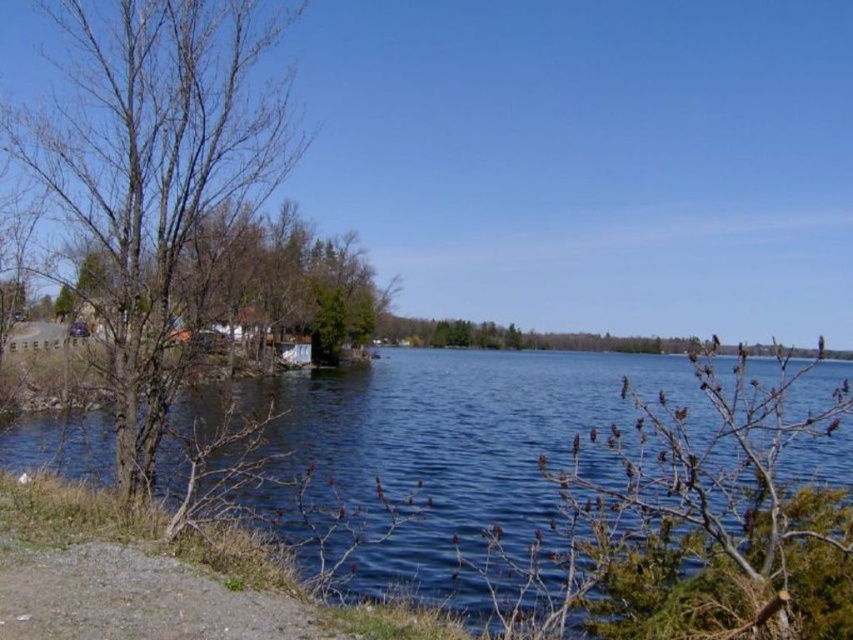
You are standing at the lakeside and want to reach a specific point marked as point (532, 504). If your walking speed is 1.2 meters per second, how long will it take you to reach that point?

The point (532, 504) is 11.32 meters away from the viewer. At a walking speed of 1.2 meters per second, it would take approximately 9.43 seconds to reach the point.

You are standing on the lakeside path and want to cross to the other side. The blue water at center and the bare wood tree at left are in your view. Which object is wider from your perspective?

The blue water at center might be wider than the bare wood tree at left according to the description.

In the scene shown: You are standing at the point marked by the coordinates point (483, 452). Based on the scene described, what would you see directly in front of you?

The point (483, 452) marks blue water at center, so you would see blue water at center directly in front of you.